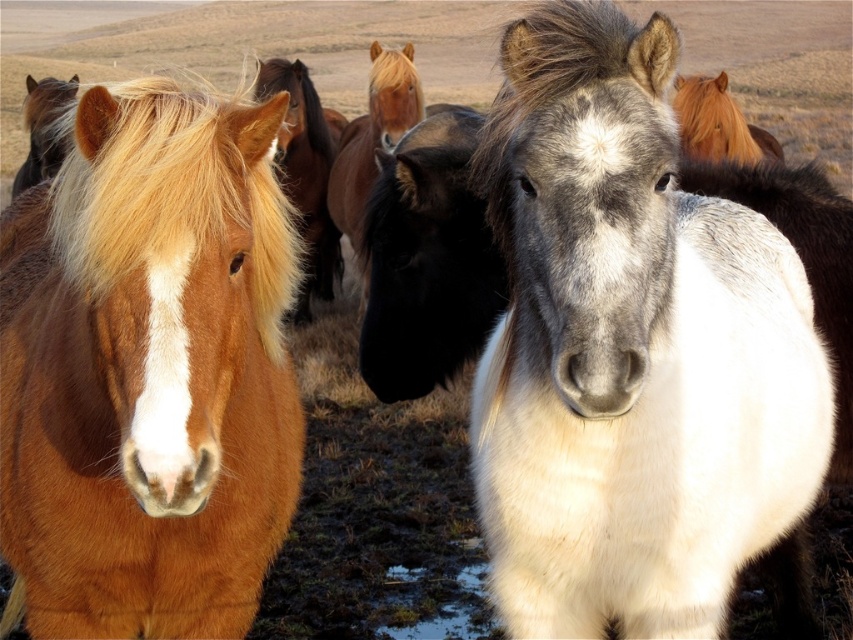
From the picture: You are standing in the field and want to reach a specific point marked at coordinates point (343,177). If your maximum comfortable walking distance is 20 feet, can you comfortably walk to that point without straining?

The distance of point (343,177) from camera is 21.89 feet, which is slightly beyond your 20 feet comfortable walking distance. Therefore, walking to that point might require some effort or adjustment.